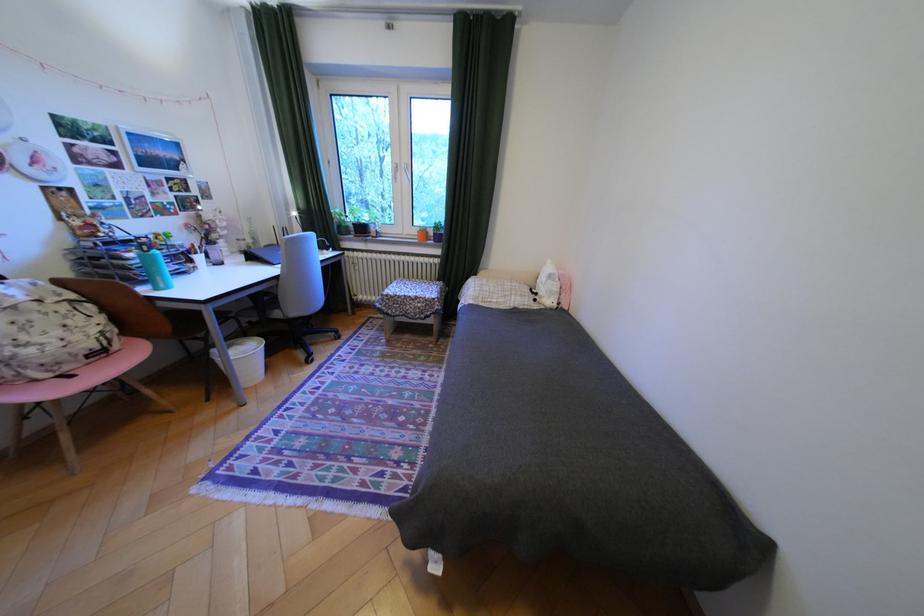
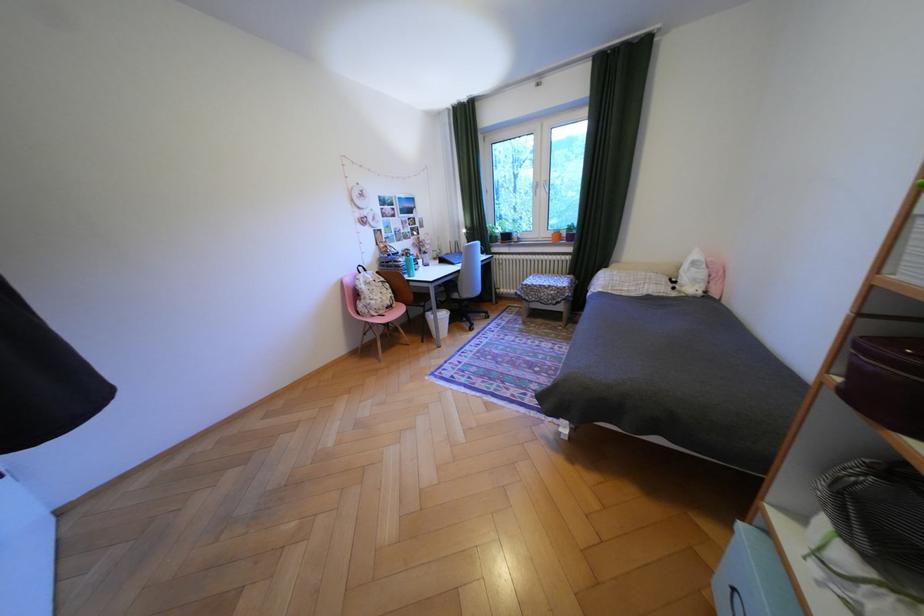
In the second image, find the point that corresponds to (79,368) in the first image.

(393, 312)